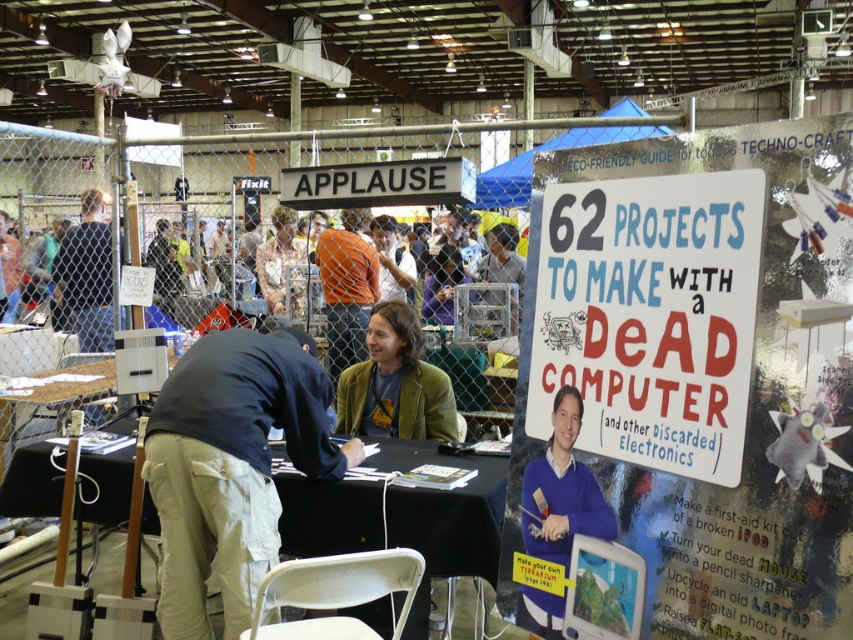
Question: In this image, where is orange shirt at center located relative to purple fabric shirt at center?

Choices:
 (A) right
 (B) left

Answer: (B)

Question: Which of the following is the closest to the observer?

Choices:
 (A) dark blue shirt at center
 (B) khaki pants at center
 (C) purple fabric shirt at center
 (D) white paper sign at center

Answer: (D)

Question: Is white paper sign at center thinner than khaki pants at center?

Choices:
 (A) no
 (B) yes

Answer: (B)

Question: Which object is the closest to the black fabric table at center?

Choices:
 (A) green textured jacket at center
 (B) purple fabric shirt at center
 (C) dark blue shirt at center

Answer: (A)

Question: Which object is the farthest from the white paper sign at center?

Choices:
 (A) blue sweater at center
 (B) green textured jacket at center
 (C) purple fabric shirt at center

Answer: (C)

Question: Is blue sweater at center further to the viewer compared to purple fabric shirt at center?

Choices:
 (A) no
 (B) yes

Answer: (A)